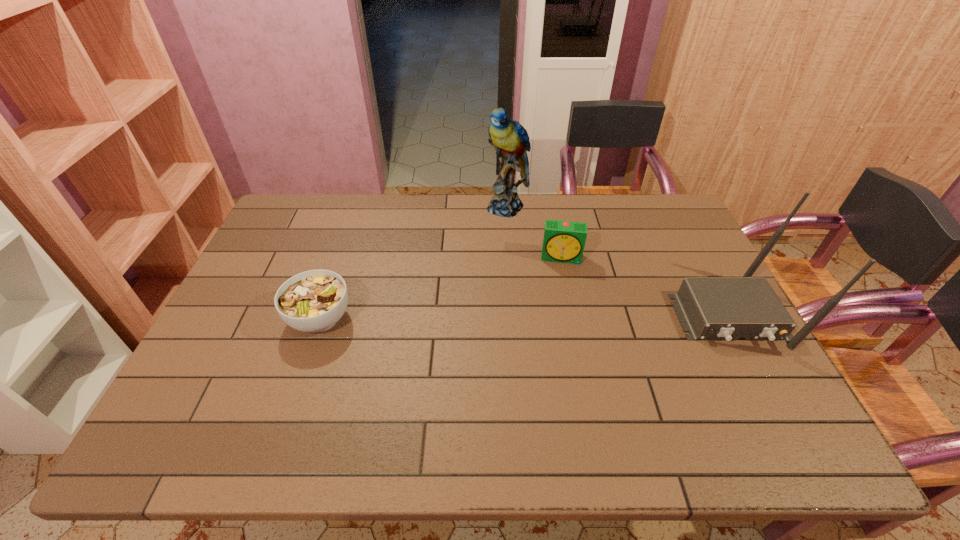
Identify the location of vacant space located on the front-facing side of the alarm clock. (558, 346).

At what (x,y) coordinates should I click in order to perform the action: click on vacant space located on the front-facing side of the alarm clock. Please return your answer as a coordinate pair (x, y). Looking at the image, I should click on [x=559, y=314].

Locate an element on the screen. This screenshot has width=960, height=540. vacant position located on the front-facing side of the alarm clock is located at coordinates (557, 368).

Where is `free location located 0.390m on the face of the parrot`? The width and height of the screenshot is (960, 540). free location located 0.390m on the face of the parrot is located at coordinates (479, 303).

Identify the location of vacant area situated on the face of the parrot. (485, 284).

Identify the location of free region located 0.270m on the face of the parrot. (488, 274).

This screenshot has width=960, height=540. I want to click on object at the far edge, so click(x=510, y=139).

Where is `object present at the right edge`? The height and width of the screenshot is (540, 960). object present at the right edge is located at coordinates (710, 308).

Where is `vacant region at the far edge of the desktop`? This screenshot has height=540, width=960. vacant region at the far edge of the desktop is located at coordinates (349, 204).

Find the location of a particular element. vacant point at the near edge is located at coordinates (388, 383).